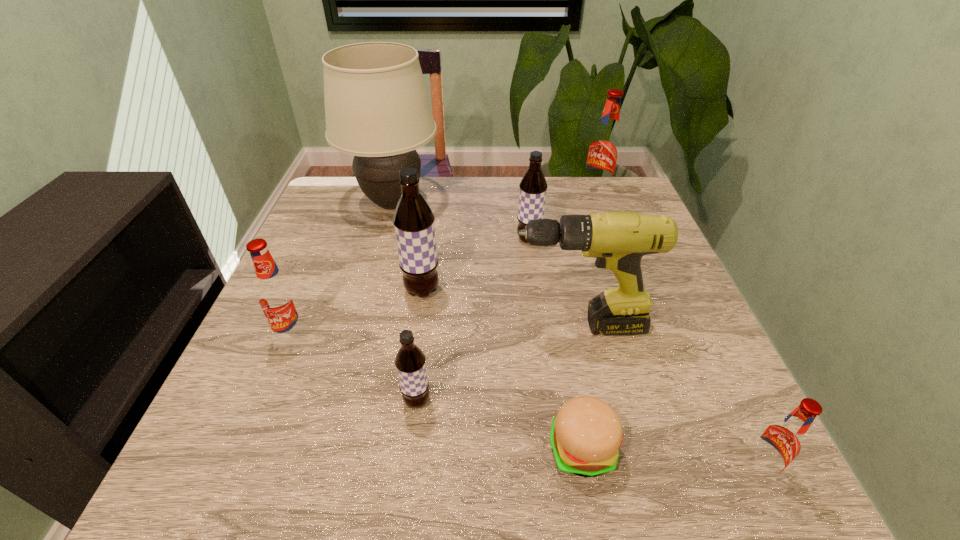
At what (x,y) coordinates should I click in order to perform the action: click on lampshade. Please return your answer as a coordinate pair (x, y). Looking at the image, I should click on (377, 108).

Identify the location of the farthest red root beer. (604, 148).

What are the coordinates of `the farthest root beer` in the screenshot? It's located at (604, 148).

Identify the location of the third farthest root beer. Image resolution: width=960 pixels, height=540 pixels. (413, 219).

Where is `the fourth farthest object`? The height and width of the screenshot is (540, 960). the fourth farthest object is located at coordinates (413, 219).

Identify the location of drill. Image resolution: width=960 pixels, height=540 pixels. click(x=618, y=239).

Find the location of `the third nearest root beer`. the third nearest root beer is located at coordinates [x=277, y=296].

You are a GUI agent. You are given a task and a screenshot of the screen. Output one action in this format:
    pyautogui.click(x=<x>, y=<y>)
    Task: Click on the leftmost root beer
    The width and height of the screenshot is (960, 540).
    Given the screenshot: What is the action you would take?
    pyautogui.click(x=277, y=296)

At what (x,y) coordinates should I click in order to perform the action: click on the rightmost brown root beer. Please return your answer as a coordinate pair (x, y). Looking at the image, I should click on (532, 195).

Locate an element on the screen. This screenshot has height=540, width=960. the farthest brown root beer is located at coordinates click(532, 195).